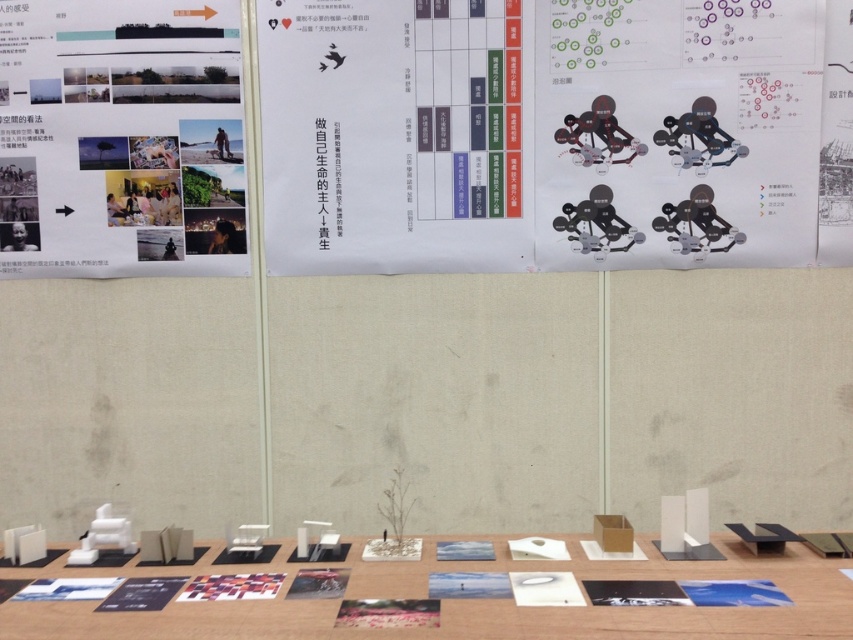
Question: Does matte paper collage at upper left appear on the right side of white matte table at center?

Choices:
 (A) no
 (B) yes

Answer: (A)

Question: Which point is closer to the camera?

Choices:
 (A) (271, 36)
 (B) (21, 136)
 (C) (579, 627)

Answer: (C)

Question: Is the position of matte paper collage at upper left more distant than that of white matte table at center?

Choices:
 (A) yes
 (B) no

Answer: (A)

Question: Considering the real-world distances, which object is closest to the matte paper collage at upper left?

Choices:
 (A) matte black poster at upper center
 (B) white matte table at center

Answer: (A)

Question: Which is nearer to the white matte table at center?

Choices:
 (A) matte paper collage at upper left
 (B) matte black poster at upper center

Answer: (B)

Question: Can you confirm if matte black poster at upper center is positioned to the left of white matte table at center?

Choices:
 (A) no
 (B) yes

Answer: (A)